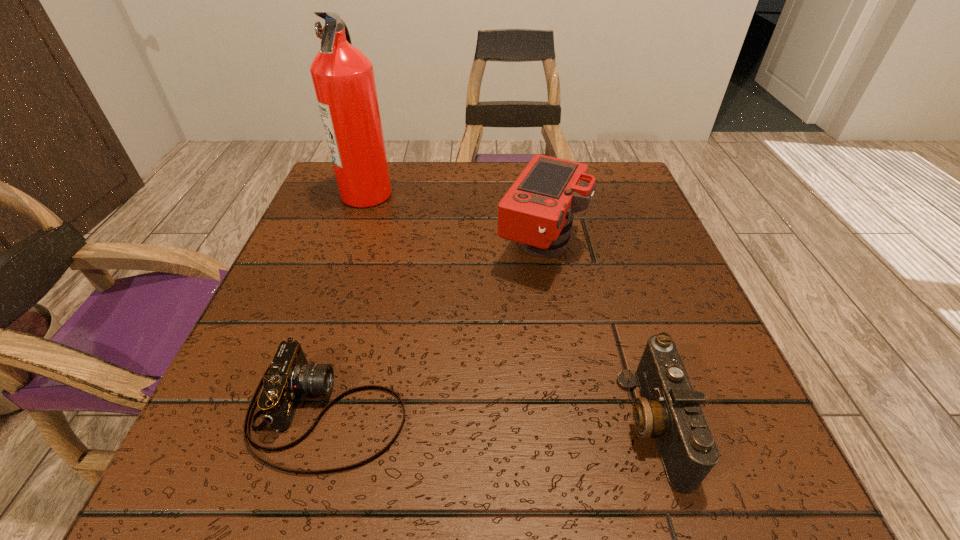
Locate an element on the screen. blank area in the image that satisfies the following two spatial constraints: 1. on the front side of the tallest camera; 2. on the front-facing side of the shortest camera is located at coordinates (566, 411).

You are a GUI agent. You are given a task and a screenshot of the screen. Output one action in this format:
    pyautogui.click(x=<x>, y=<y>)
    Task: Click on the vacant region that satisfies the following two spatial constraints: 1. at the nozzle of the tallest object; 2. on the back side of the tallest camera
    This screenshot has height=540, width=960.
    Given the screenshot: What is the action you would take?
    pyautogui.click(x=348, y=247)